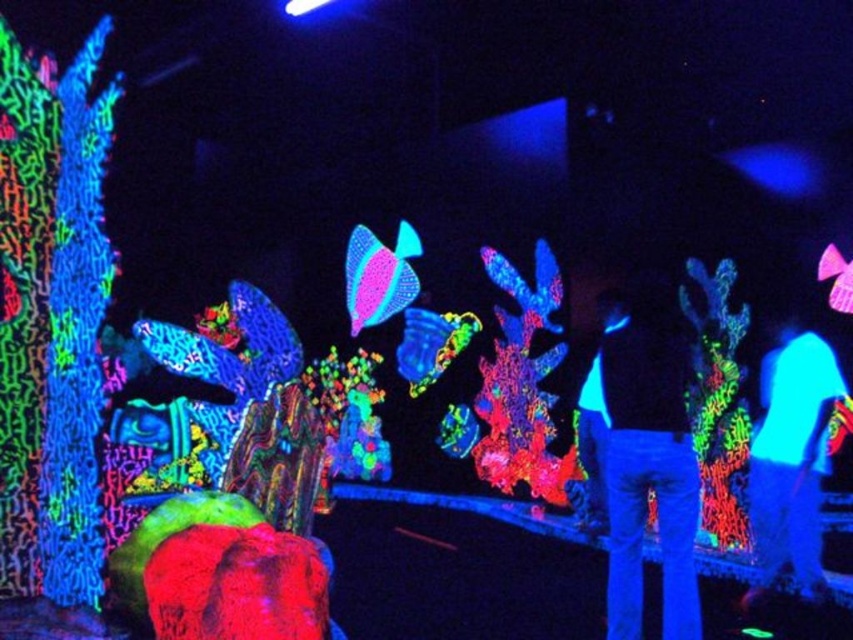
Question: Does matte black jacket at center appear on the right side of neon blue fabric at center?

Choices:
 (A) no
 (B) yes

Answer: (A)

Question: Which point is farther to the camera?

Choices:
 (A) (662, 429)
 (B) (788, 563)

Answer: (B)

Question: Does matte black jacket at center have a smaller size compared to neon blue fabric at center?

Choices:
 (A) no
 (B) yes

Answer: (B)

Question: Among these objects, which one is nearest to the camera?

Choices:
 (A) neon blue fabric at center
 (B) matte black jacket at center

Answer: (B)

Question: Can you confirm if matte black jacket at center is positioned to the left of neon blue fabric at center?

Choices:
 (A) yes
 (B) no

Answer: (A)